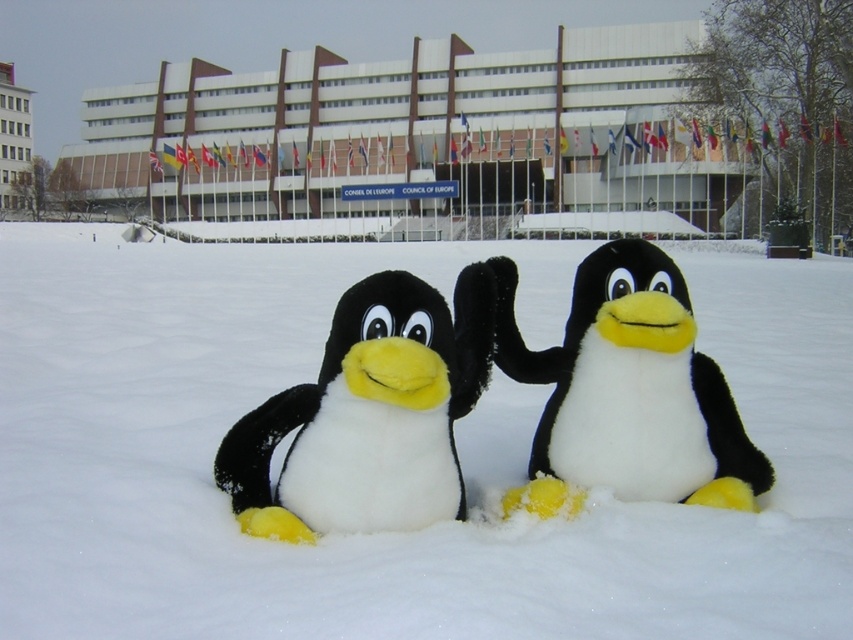
You are standing at a point 5.42 meters away from the camera. You want to take a photo of the two plush penguin toys on the snowy ground in front of the Council of Europe headquarters. Can you confirm if you are positioned at the point labeled as point (810, 348)?

Yes, since the point (810, 348) is 5.42 meters away from the camera, you are positioned at that point.